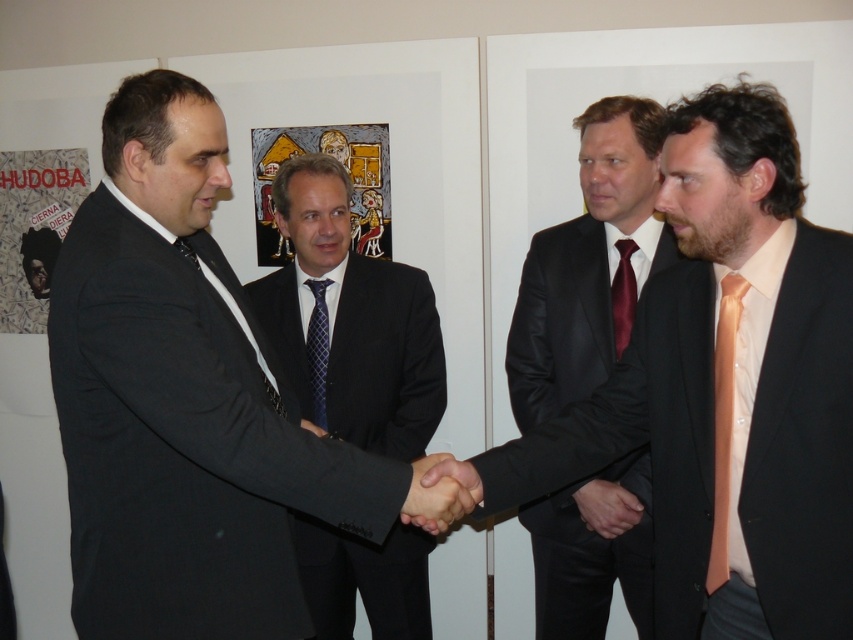
Question: Considering the relative positions of orange silk tie at right and black satin hand at center in the image provided, where is orange silk tie at right located with respect to black satin hand at center?

Choices:
 (A) above
 (B) below

Answer: (A)

Question: Does black suit at left appear under black leather suit at center?

Choices:
 (A) yes
 (B) no

Answer: (B)

Question: Which object appears farthest from the camera in this image?

Choices:
 (A) blue textured tie at center
 (B) matte black suit at center

Answer: (A)

Question: Among these points, which one is nearest to the camera?

Choices:
 (A) (718, 332)
 (B) (618, 502)

Answer: (A)

Question: Is blue textured tie at center in front of black satin hand at center?

Choices:
 (A) yes
 (B) no

Answer: (B)

Question: Which object is positioned closest to the matte black suit at center?

Choices:
 (A) orange silk tie at right
 (B) black glossy hands at center

Answer: (A)